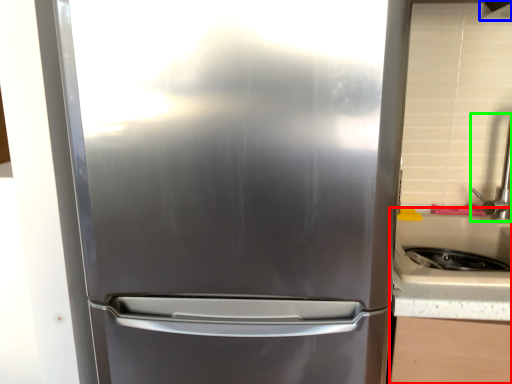
Question: Which is nearer to the counter top (highlighted by a red box)? exhaust hood (highlighted by a blue box) or faucet (highlighted by a green box).

Choices:
 (A) exhaust hood
 (B) faucet

Answer: (B)